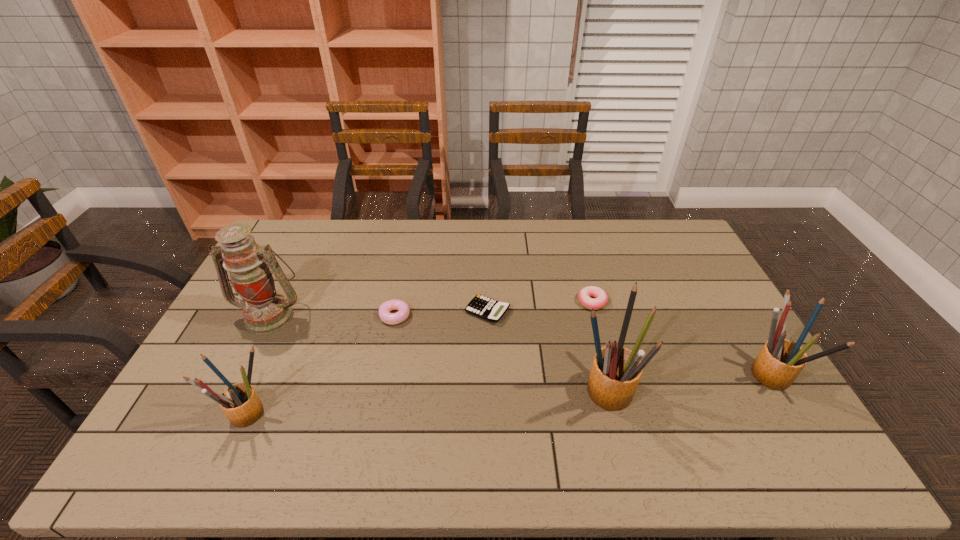
If the aim is uniform spacing by inserting an additional pencil_box among them, please point to a vacant space for this new pencil_box. Please provide its 2D coordinates. Your answer should be formatted as a tuple, i.e. [(x, y)], where the tuple contains the x and y coordinates of a point satisfying the conditions above.

[(429, 400)]